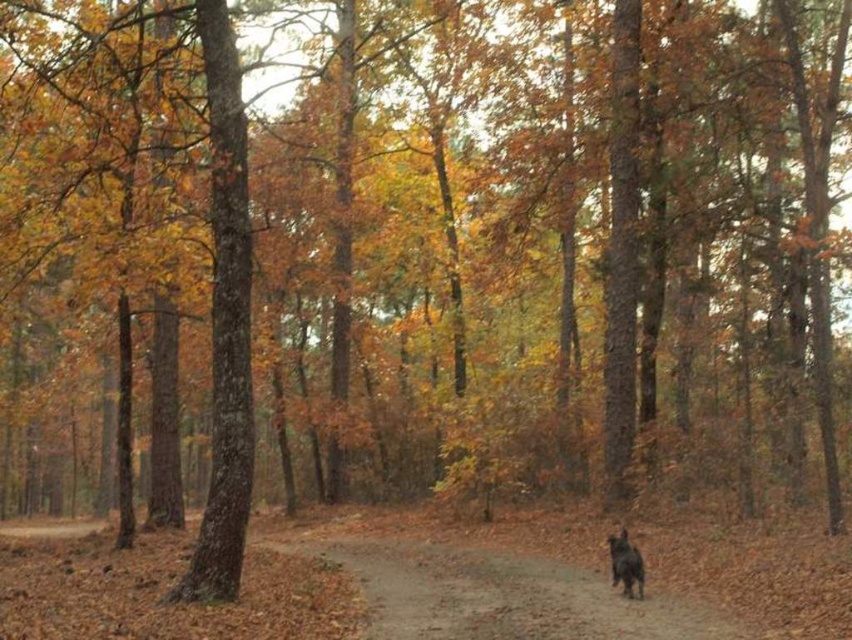
You are a hiker trying to walk your black furry dog at lower right along the brown dirt path at center. Can the dog walk comfortably on the path without stepping off it?

The brown dirt path at center is wider than the black furry dog at lower right, so the dog can walk comfortably on the path without stepping off it.

You are a hiker who wants to walk along the dirt path in the autumn forest. However, you notice the black furry dog at lower right is blocking the path. Can you still walk along the brown dirt path at center without stepping on the dog?

The brown dirt path at center is much taller than the black furry dog at lower right, so the path is elevated and you can walk along it safely without stepping on the dog.

You are standing in the autumnal forest scene and want to walk along the dirt path. Which object, the brown dirt path at center or the black furry dog at lower right, is closer to you as you start walking?

The brown dirt path at center is closer to the viewer than the black furry dog at lower right, so you would first encounter the brown dirt path at center as you start walking.